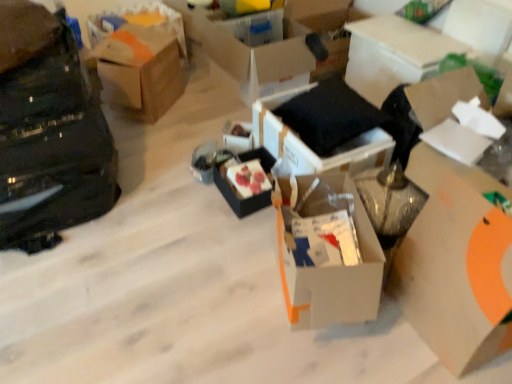
This screenshot has width=512, height=384. Identify the location of free space to the left of white cardboard box at right, the third box in the right-to-left sequence. (386, 345).